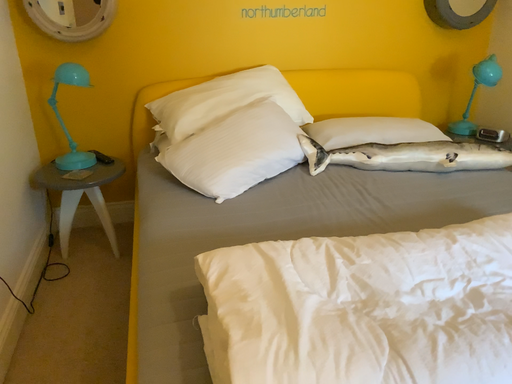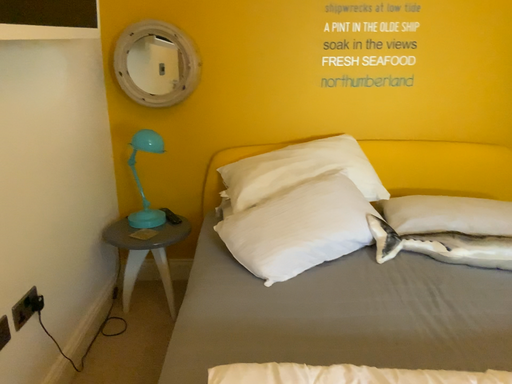
Question: Which way did the camera rotate in the video?

Choices:
 (A) rotated upward
 (B) rotated downward

Answer: (A)